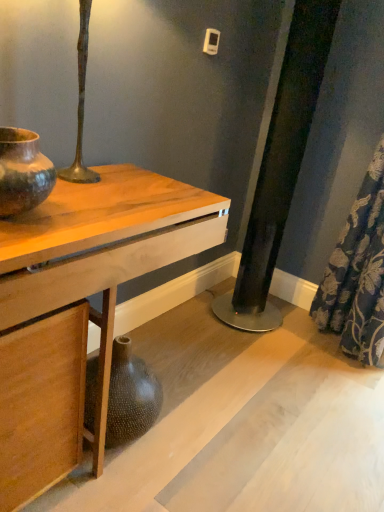
Question: Is point (51, 404) closer or farther from the camera than point (377, 315)?

Choices:
 (A) closer
 (B) farther

Answer: (A)

Question: From a real-world perspective, is wooden table at center positioned above or below blue floral fabric at lower right?

Choices:
 (A) below
 (B) above

Answer: (A)

Question: Based on their relative distances, which object is farther from the wooden table at center?

Choices:
 (A) matte brown ceramic vase at left
 (B) blue floral fabric at lower right

Answer: (B)

Question: Which object is the farthest from the matte brown ceramic vase at left?

Choices:
 (A) blue floral fabric at lower right
 (B) wooden table at center

Answer: (A)